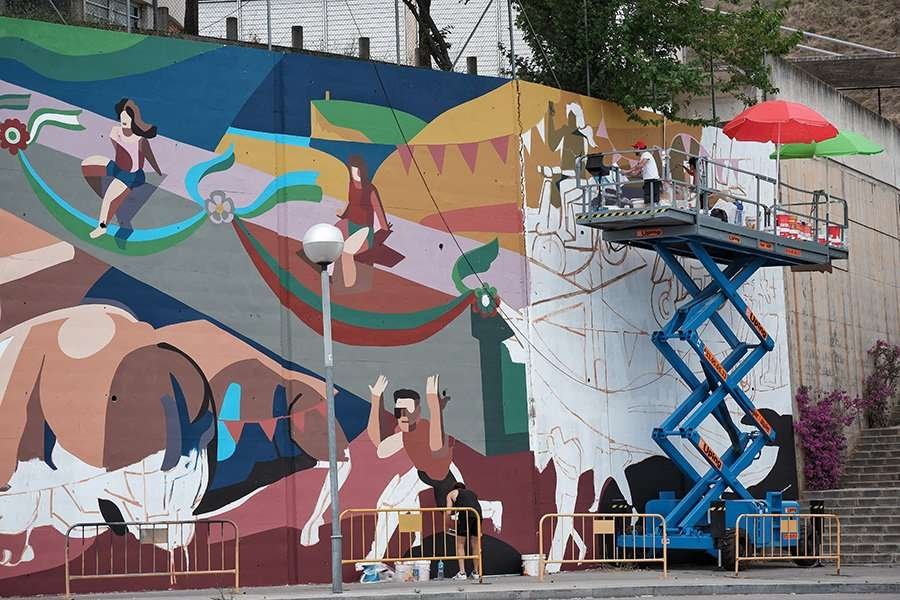
Identify the location of white paint. The image size is (900, 600). (87, 499).